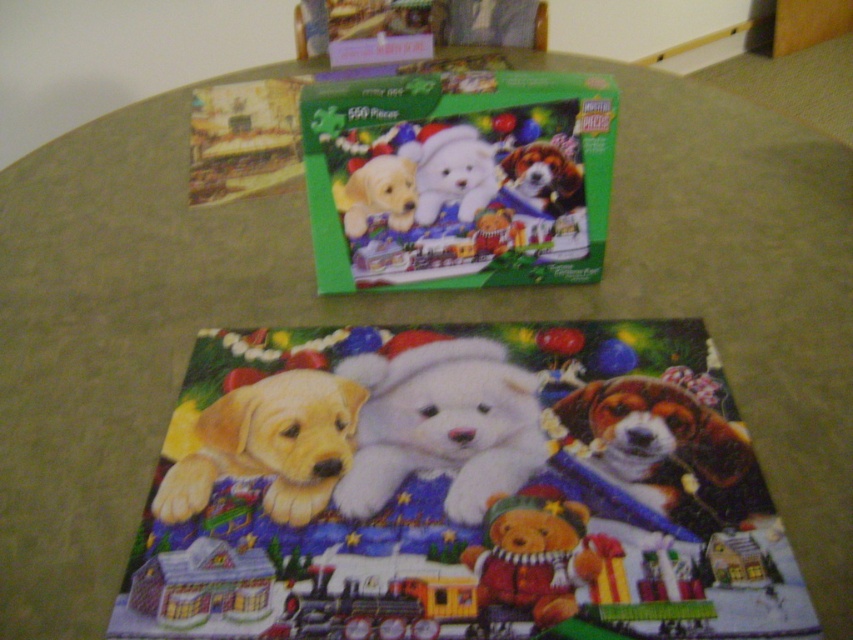
Question: Which object appears closest to the camera in this image?

Choices:
 (A) white plush teddy bear at center
 (B) white plush teddy bear at upper center
 (C) golden fur puppy at center
 (D) velvety brown teddy bear at lower right

Answer: (D)

Question: Is white plush teddy bear at center to the right of white plush teddy bear at upper center from the viewer's perspective?

Choices:
 (A) no
 (B) yes

Answer: (A)

Question: Is white plush teddy bear at center bigger than golden fur puppy at center?

Choices:
 (A) no
 (B) yes

Answer: (B)

Question: Which object is closer to the camera taking this photo?

Choices:
 (A) golden fur puppy at center
 (B) velvety brown teddy bear at lower right

Answer: (B)

Question: Does golden fur puppy at center have a lesser width compared to velvety brown teddy bear at lower right?

Choices:
 (A) yes
 (B) no

Answer: (B)

Question: Which object appears closest to the camera in this image?

Choices:
 (A) velvety brown teddy bear at lower right
 (B) white plush teddy bear at center
 (C) white plush teddy bear at upper center

Answer: (A)